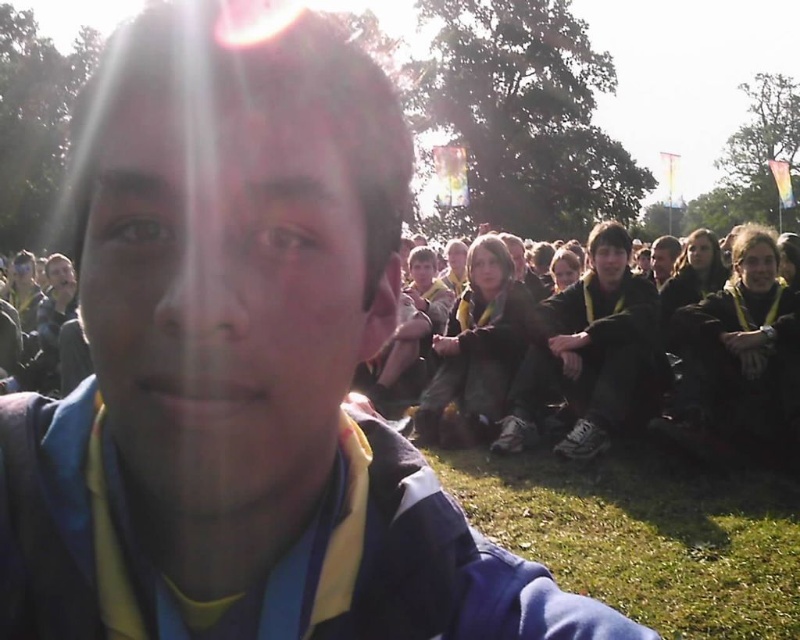
You are planning to set up a picnic blanket in the area where the green grass at lower right and the dark brown leather jacket at center are located. Considering their sizes, which area would be more suitable for placing a large picnic blanket?

The green grass at lower right has a larger width than the dark brown leather jacket at center, so placing the large picnic blanket on the green grass at lower right would be more suitable due to its greater space availability.

You are a photographer trying to capture a clear shot of the dark brown leather jacket at center. However, the green grass at lower right is blocking part of the jacket. Can you adjust your position to avoid the grass while still keeping the jacket in frame?

The green grass at lower right is not as tall as dark brown leather jacket at center, so you can lower your camera angle to position the jacket above the grass, ensuring the jacket remains in frame while avoiding the grass obstruction.

You are standing in the park and see a point marked at coordinates (645, 534). What is located at that point?

The point at coordinates (645, 534) indicates green grass at lower right.